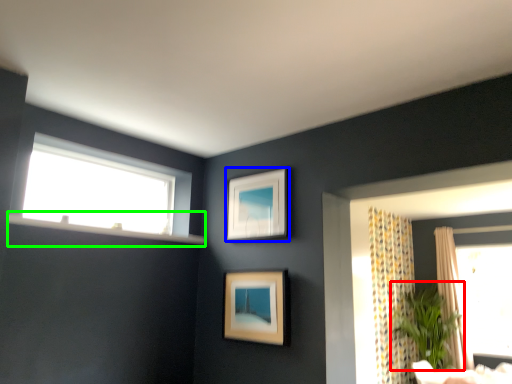
Question: Which is farther away from plant (highlighted by a red box)? picture frame (highlighted by a blue box) or window sill (highlighted by a green box)?

Choices:
 (A) picture frame
 (B) window sill

Answer: (B)